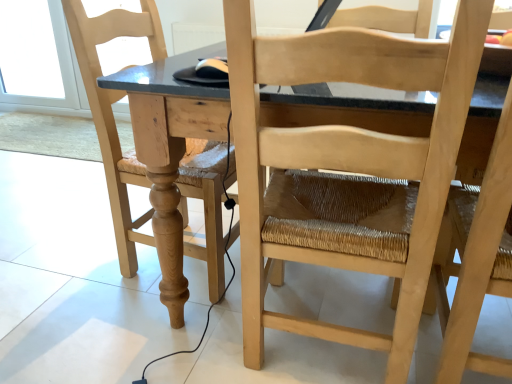
Question: From the image's perspective, does natural wood chair at right, the third chair positioned from the left, appear higher than transparent glass door at upper left?

Choices:
 (A) yes
 (B) no

Answer: (B)

Question: Does natural wood chair at right, which is the 1th chair in right-to-left order, have a greater width compared to transparent glass door at upper left?

Choices:
 (A) no
 (B) yes

Answer: (B)

Question: Is natural wood chair at right, the third chair positioned from the left, touching transparent glass door at upper left?

Choices:
 (A) no
 (B) yes

Answer: (A)

Question: Is natural wood chair at right, the third chair positioned from the left, turned away from transparent glass door at upper left?

Choices:
 (A) no
 (B) yes

Answer: (A)

Question: Does natural wood chair at right, the third chair positioned from the left, turn towards transparent glass door at upper left?

Choices:
 (A) no
 (B) yes

Answer: (A)

Question: Is natural wood chair at right, which is the 1th chair in right-to-left order, shorter than transparent glass door at upper left?

Choices:
 (A) yes
 (B) no

Answer: (B)

Question: Would you say natural wood chair at left, the third chair positioned from the right, contains natural wood chair at right, which is the 1th chair in right-to-left order?

Choices:
 (A) yes
 (B) no

Answer: (B)

Question: From the image's perspective, is natural wood chair at left, the third chair positioned from the right, located beneath natural wood chair at right, the third chair positioned from the left?

Choices:
 (A) no
 (B) yes

Answer: (A)

Question: Considering the relative positions of natural wood chair at left, the first chair in the left-to-right sequence, and natural wood chair at right, the third chair positioned from the left, in the image provided, is natural wood chair at left, the first chair in the left-to-right sequence, to the right of natural wood chair at right, the third chair positioned from the left, from the viewer's perspective?

Choices:
 (A) yes
 (B) no

Answer: (B)

Question: Is natural wood chair at left, the first chair in the left-to-right sequence, thinner than natural wood chair at right, which is the 1th chair in right-to-left order?

Choices:
 (A) yes
 (B) no

Answer: (B)

Question: Are natural wood chair at left, the first chair in the left-to-right sequence, and natural wood chair at right, which is the 1th chair in right-to-left order, making contact?

Choices:
 (A) no
 (B) yes

Answer: (A)

Question: Is natural wood chair at left, the third chair positioned from the right, aimed at natural wood chair at right, which is the 1th chair in right-to-left order?

Choices:
 (A) no
 (B) yes

Answer: (B)

Question: Considering the relative sizes of natural wood chair at right, which is the 1th chair in right-to-left order, and natural wood table at center in the image provided, is natural wood chair at right, which is the 1th chair in right-to-left order, shorter than natural wood table at center?

Choices:
 (A) no
 (B) yes

Answer: (A)